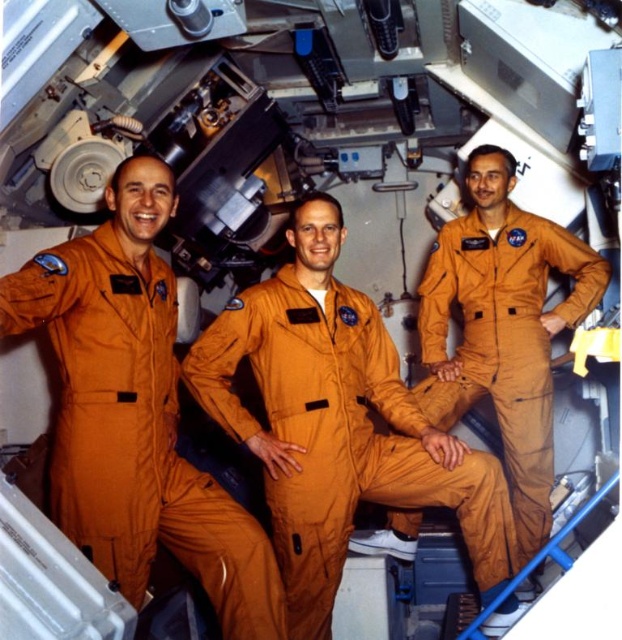
Question: Is orange smooth jumpsuit at center below orange fabric jumpsuit at center?

Choices:
 (A) yes
 (B) no

Answer: (B)

Question: Which object is the farthest from the orange fabric jumpsuit at center?

Choices:
 (A) matte orange jumpsuit at center
 (B) orange smooth jumpsuit at center

Answer: (A)

Question: Does orange smooth jumpsuit at center have a lesser width compared to orange fabric jumpsuit at center?

Choices:
 (A) yes
 (B) no

Answer: (A)

Question: Which object is positioned farthest from the matte orange jumpsuit at center?

Choices:
 (A) orange smooth jumpsuit at center
 (B) orange fabric jumpsuit at center

Answer: (A)

Question: Observing the image, what is the correct spatial positioning of orange smooth jumpsuit at center in reference to orange fabric jumpsuit at center?

Choices:
 (A) above
 (B) below

Answer: (A)

Question: Which of these objects is positioned farthest from the matte orange jumpsuit at center?

Choices:
 (A) orange fabric jumpsuit at center
 (B) orange smooth jumpsuit at center

Answer: (B)